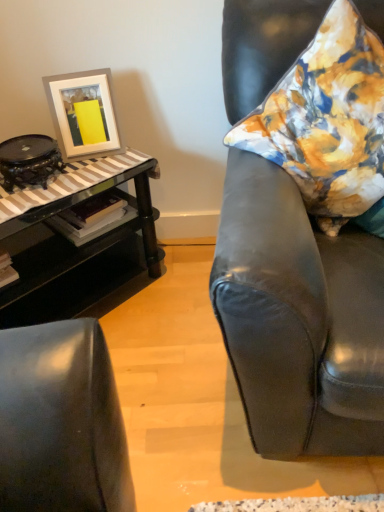
Find the location of a particular element. The width and height of the screenshot is (384, 512). free space on the front side of white matte picture frame at upper left is located at coordinates (97, 172).